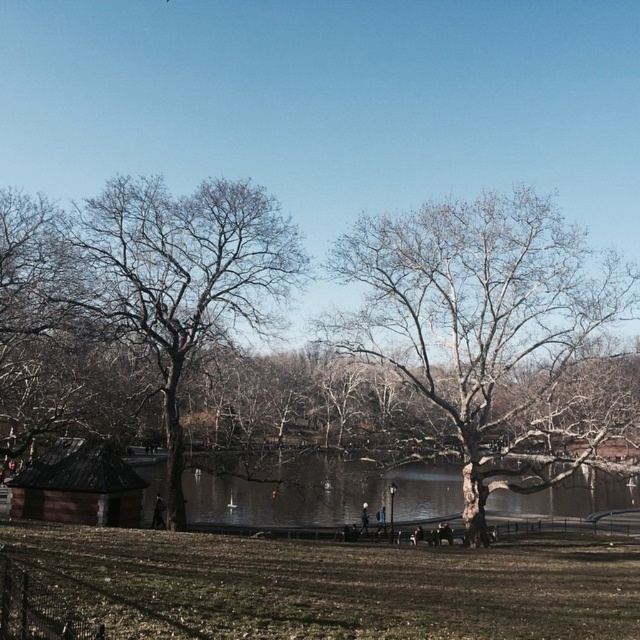
Question: Estimate the real-world distances between objects in this image. Which object is farther from the bare wood tree at left?

Choices:
 (A) clear water at center
 (B) bare wood tree at center

Answer: (A)

Question: Which object is positioned farthest from the clear water at center?

Choices:
 (A) bare wood tree at center
 (B) bare wood tree at left

Answer: (B)

Question: Is bare wood tree at center wider than clear water at center?

Choices:
 (A) no
 (B) yes

Answer: (A)

Question: Among these points, which one is farthest from the camera?

Choices:
 (A) (352, 474)
 (B) (74, 216)
 (C) (570, 362)

Answer: (A)

Question: Can you confirm if bare wood tree at center is wider than bare wood tree at left?

Choices:
 (A) no
 (B) yes

Answer: (B)

Question: Considering the relative positions of bare wood tree at center and clear water at center in the image provided, where is bare wood tree at center located with respect to clear water at center?

Choices:
 (A) right
 (B) left

Answer: (A)